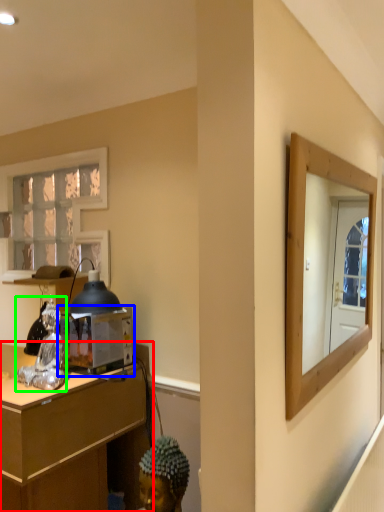
Question: Estimate the real-world distances between objects in this image. Which object is closer to desk (highlighted by a red box), appliance (highlighted by a blue box) or figurine (highlighted by a green box)?

Choices:
 (A) appliance
 (B) figurine

Answer: (A)